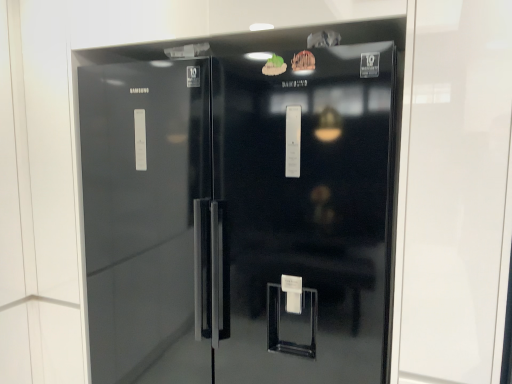
Question: Considering the relative positions of green matte food at upper center, which appears as the first food when viewed from the left, and glossy black refrigerator at center in the image provided, is green matte food at upper center, which appears as the first food when viewed from the left, to the left of glossy black refrigerator at center from the viewer's perspective?

Choices:
 (A) no
 (B) yes

Answer: (A)

Question: Is green matte food at upper center, which appears as the first food when viewed from the left, touching glossy black refrigerator at center?

Choices:
 (A) yes
 (B) no

Answer: (B)

Question: Considering the relative positions of green matte food at upper center, which appears as the first food when viewed from the left, and glossy black refrigerator at center in the image provided, is green matte food at upper center, which appears as the first food when viewed from the left, behind glossy black refrigerator at center?

Choices:
 (A) no
 (B) yes

Answer: (B)

Question: Is green matte food at upper center, which appears as the first food when viewed from the left, facing towards glossy black refrigerator at center?

Choices:
 (A) no
 (B) yes

Answer: (B)

Question: Can you confirm if green matte food at upper center, the second food from the right, is taller than glossy black refrigerator at center?

Choices:
 (A) no
 (B) yes

Answer: (A)

Question: Does green matte food at upper center, which appears as the first food when viewed from the left, have a lesser width compared to glossy black refrigerator at center?

Choices:
 (A) yes
 (B) no

Answer: (A)

Question: Is the depth of wooden carving at upper center, acting as the first food starting from the right, less than that of glossy black refrigerator at center?

Choices:
 (A) yes
 (B) no

Answer: (B)

Question: Is wooden carving at upper center, positioned as the 2th food in left-to-right order, surrounding glossy black refrigerator at center?

Choices:
 (A) no
 (B) yes

Answer: (A)

Question: Considering the relative sizes of wooden carving at upper center, positioned as the 2th food in left-to-right order, and glossy black refrigerator at center in the image provided, is wooden carving at upper center, positioned as the 2th food in left-to-right order, smaller than glossy black refrigerator at center?

Choices:
 (A) yes
 (B) no

Answer: (A)

Question: Is wooden carving at upper center, acting as the first food starting from the right, turned away from glossy black refrigerator at center?

Choices:
 (A) yes
 (B) no

Answer: (A)

Question: From a real-world perspective, is wooden carving at upper center, positioned as the 2th food in left-to-right order, positioned under glossy black refrigerator at center based on gravity?

Choices:
 (A) yes
 (B) no

Answer: (B)

Question: Is wooden carving at upper center, acting as the first food starting from the right, to the right of glossy black refrigerator at center from the viewer's perspective?

Choices:
 (A) no
 (B) yes

Answer: (B)

Question: Considering the relative sizes of glossy black refrigerator at center and green matte food at upper center, which appears as the first food when viewed from the left, in the image provided, is glossy black refrigerator at center shorter than green matte food at upper center, which appears as the first food when viewed from the left,?

Choices:
 (A) no
 (B) yes

Answer: (A)